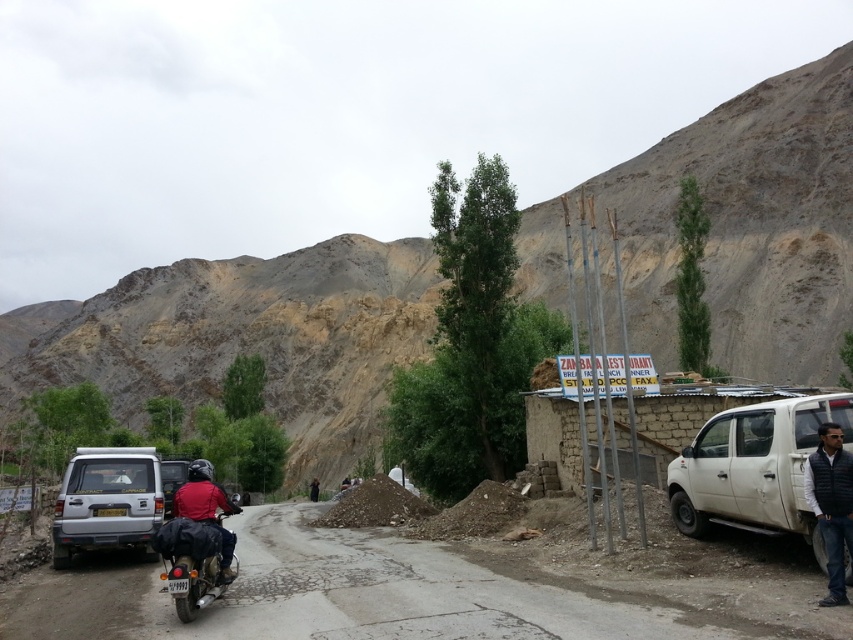
Who is taller, white matte truck at right or silver metallic minivan at center-left?

silver metallic minivan at center-left

Between white matte truck at right and silver metallic minivan at center-left, which one appears on the left side from the viewer's perspective?

silver metallic minivan at center-left

At what (x,y) coordinates should I click in order to perform the action: click on white matte truck at right. Please return your answer as a coordinate pair (x, y). Looking at the image, I should click on (753, 467).

I want to click on white matte truck at right, so click(753, 467).

Is dirt road at center smaller than red matte jacket at center?

No.

Can you confirm if dirt road at center is shorter than red matte jacket at center?

Indeed, dirt road at center has a lesser height compared to red matte jacket at center.

Is point (366, 532) in front of point (194, 474)?

No, (366, 532) is behind (194, 474).

The height and width of the screenshot is (640, 853). Identify the location of dirt road at center. (347, 595).

Which is below, brown rocky hillside at upper center or dark blue quilted vest at right?

dark blue quilted vest at right

Is point (276, 388) positioned in front of point (838, 554)?

No.

The height and width of the screenshot is (640, 853). Identify the location of brown rocky hillside at upper center. (254, 339).